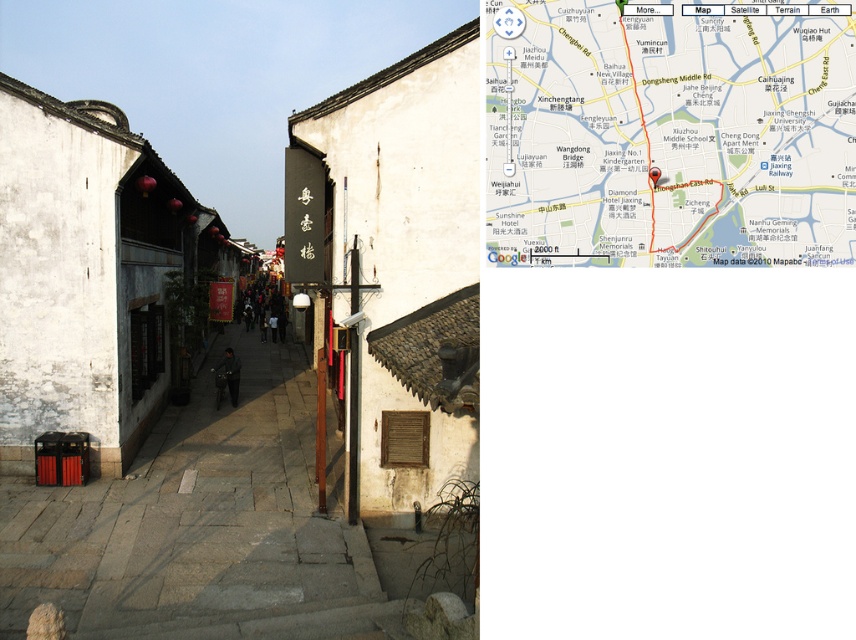
Question: Which point is closer to the camera?

Choices:
 (A) gray stone stairs at lower center
 (B) white paper map at center
 (C) matte stone alley at center

Answer: (B)

Question: Does matte stone alley at center have a lesser width compared to gray stone stairs at lower center?

Choices:
 (A) no
 (B) yes

Answer: (A)

Question: Which of the following is the farthest from the observer?

Choices:
 (A) [x=270, y=618]
 (B) [x=232, y=614]
 (C) [x=845, y=102]

Answer: (B)

Question: Does white paper map at center have a greater width compared to gray stone stairs at lower center?

Choices:
 (A) yes
 (B) no

Answer: (B)

Question: Estimate the real-world distances between objects in this image. Which object is closer to the white paper map at center?

Choices:
 (A) matte stone alley at center
 (B) gray stone stairs at lower center

Answer: (B)

Question: Does white paper map at center lie in front of gray stone stairs at lower center?

Choices:
 (A) no
 (B) yes

Answer: (B)